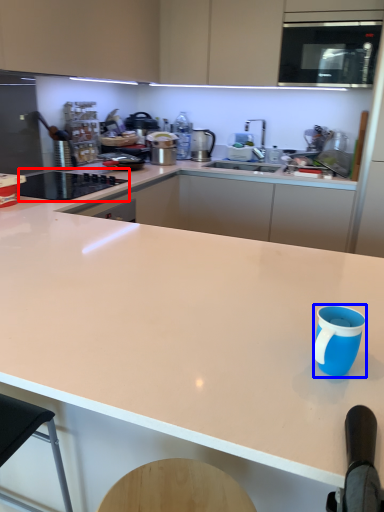
Question: Which object appears closest to the camera in this image, home appliance (highlighted by a red box) or mug (highlighted by a blue box)?

Choices:
 (A) home appliance
 (B) mug

Answer: (B)